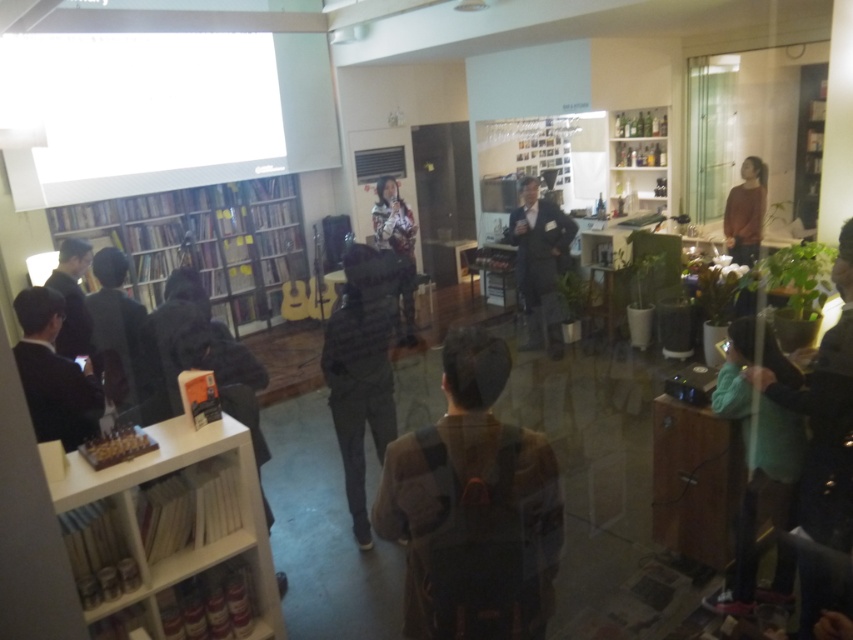
Does wooden bookcase at left have a smaller size compared to dark gray suit at left?

Actually, wooden bookcase at left might be larger than dark gray suit at left.

Does wooden bookcase at left have a larger size compared to dark gray suit at left?

Yes.

Identify the location of wooden bookcase at left. This screenshot has width=853, height=640. (206, 241).

Is the position of green fabric jacket at lower right more distant than that of dark gray suit at left?

That is False.

Does green fabric jacket at lower right have a lesser width compared to dark gray suit at left?

Yes, green fabric jacket at lower right is thinner than dark gray suit at left.

Which is in front, point (746, 432) or point (112, 268)?

Point (746, 432)

Where is `green fabric jacket at lower right`? This screenshot has height=640, width=853. green fabric jacket at lower right is located at coordinates (756, 445).

Who is positioned more to the right, brown fabric backpack at center or dark gray suit at center?

Positioned to the right is dark gray suit at center.

Where is `brown fabric backpack at center`? brown fabric backpack at center is located at coordinates (473, 508).